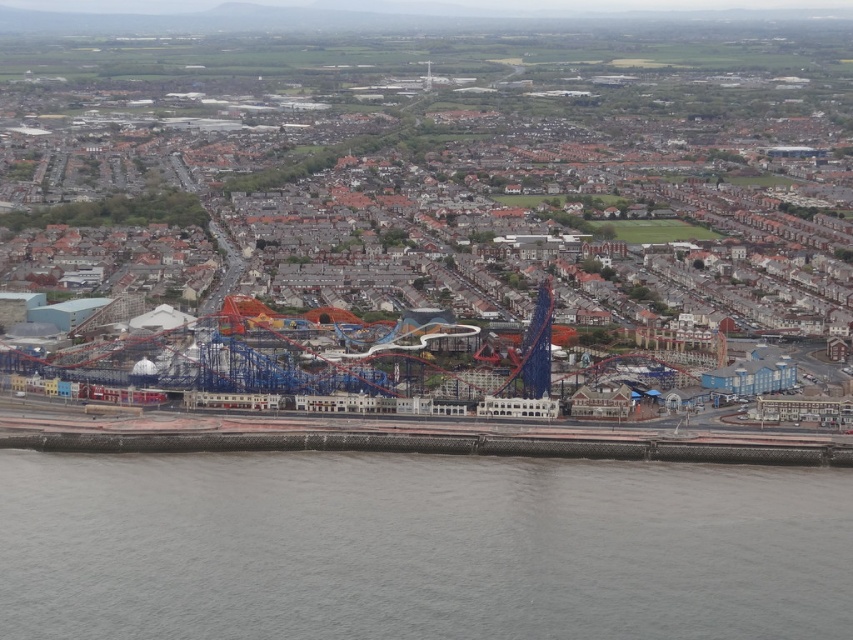
You are a drone operator who needs to capture a photo of the blue metallic roller coaster at center. The drone is currently hovering at point 0.317, 0.529. Is the drone directly above the roller coaster?

Yes, the blue metallic roller coaster at center is located at point (450, 202), so the drone is directly above it.